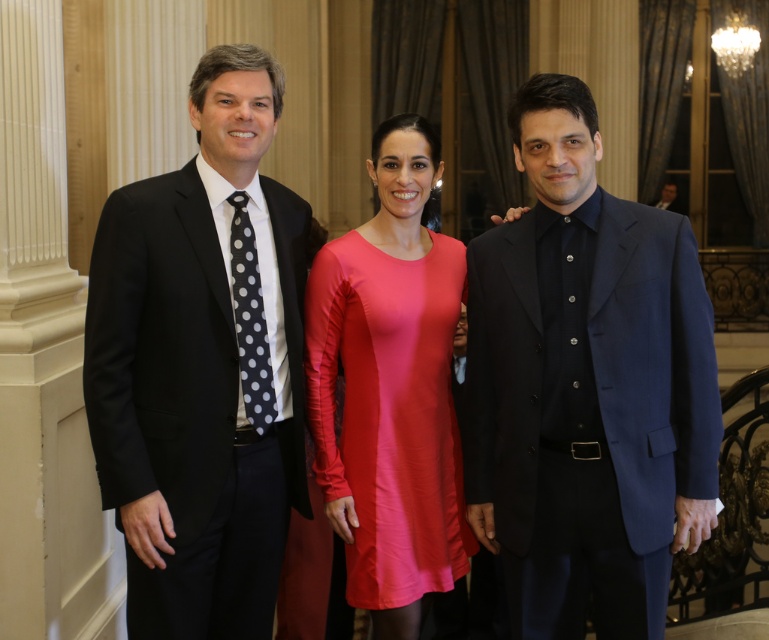
Question: Does matte blue suit at center lie behind matte pink dress at center?

Choices:
 (A) no
 (B) yes

Answer: (A)

Question: Which object is closer to the camera taking this photo?

Choices:
 (A) matte blue suit at center
 (B) matte black suit at left

Answer: (B)

Question: Which of the following is the closest to the observer?

Choices:
 (A) (664, 605)
 (B) (273, 609)
 (C) (394, 321)

Answer: (A)

Question: Does matte blue suit at center appear on the left side of black dotted tie at left?

Choices:
 (A) yes
 (B) no

Answer: (B)

Question: In this image, where is matte black suit at left located relative to matte pink dress at center?

Choices:
 (A) left
 (B) right

Answer: (A)

Question: Estimate the real-world distances between objects in this image. Which object is closer to the matte black suit at left?

Choices:
 (A) black dotted tie at left
 (B) matte pink dress at center

Answer: (A)